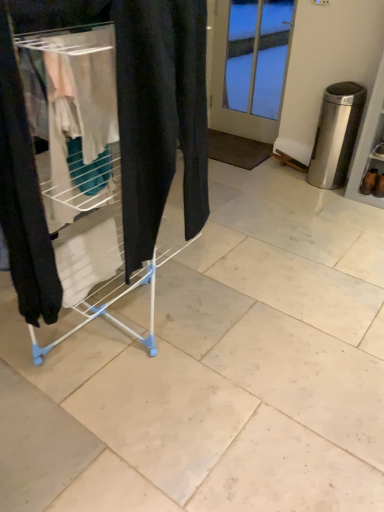
Find the location of a particular element. free space to the left of satin silver trash can at right is located at coordinates point(291,180).